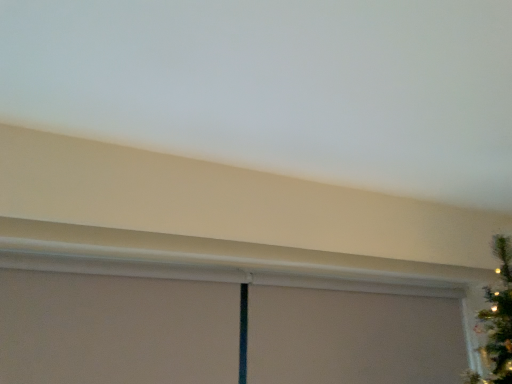
The image size is (512, 384). What do you see at coordinates (353, 338) in the screenshot?
I see `matte white window screen at lower center` at bounding box center [353, 338].

I want to click on matte white window screen at lower center, so click(x=353, y=338).

This screenshot has width=512, height=384. I want to click on matte white window screen at lower center, so click(x=353, y=338).